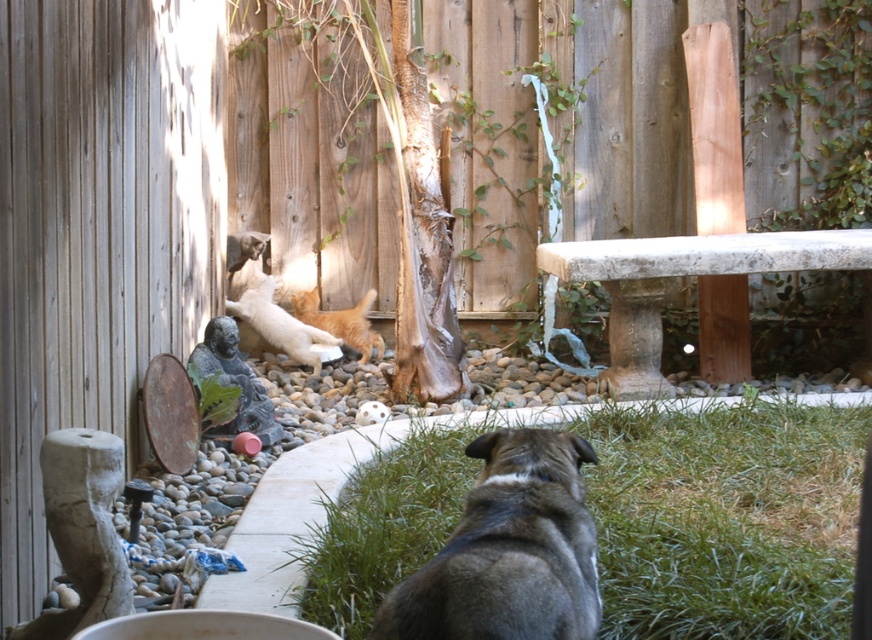
You are a drone operator trying to capture a photo of the white cloth or ribbon on the small tree trunk in the center. Your drone is currently hovering at point (508,550). Is this point on the brown fur dog at lower center or somewhere else?

The point (508,550) is on the brown fur dog at lower center, so the drone is currently hovering over the dog and not the tree trunk. Adjust the drone to move towards the center to capture the ribbon on the tree trunk.

You are a photographer trying to capture the fluffy orange cat at center and the brown fur dog at lower center in the same frame. From the perspective of the photographer, which animal is on the right side?

The brown fur dog at lower center is on the right side of the fluffy orange cat at center, so from the photographer perspective, the brown fur dog at lower center is on the right side.